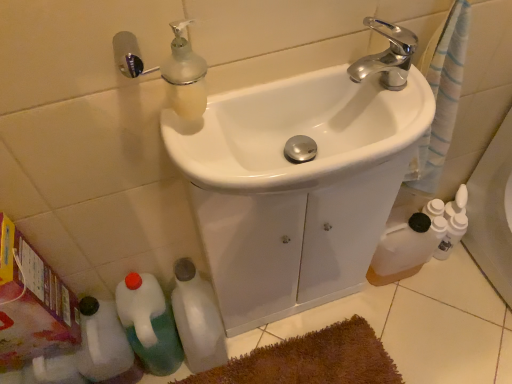
You are a GUI agent. You are given a task and a screenshot of the screen. Output one action in this format:
    pyautogui.click(x=<x>, y=<y>)
    Task: Click on the free space to the right of white glossy sink at center, the 2th sink viewed from the front
    The image size is (512, 384).
    Given the screenshot: What is the action you would take?
    pyautogui.click(x=389, y=317)